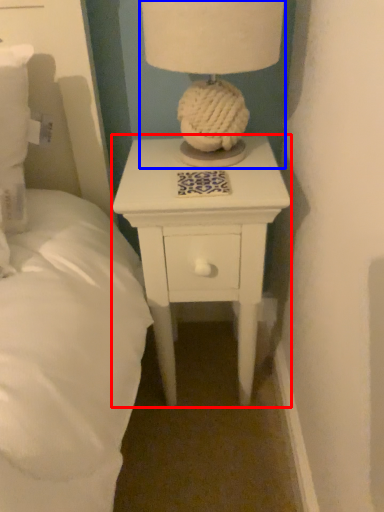
Question: Among these objects, which one is farthest to the camera, nightstand (highlighted by a red box) or table lamp (highlighted by a blue box)?

Choices:
 (A) nightstand
 (B) table lamp

Answer: (A)